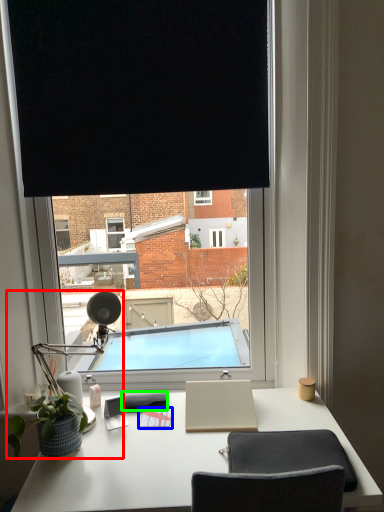
Question: Which is farther away from table lamp (highlighted by a red box)? notepad (highlighted by a blue box) or notepad (highlighted by a green box)?

Choices:
 (A) notepad
 (B) notepad

Answer: (A)